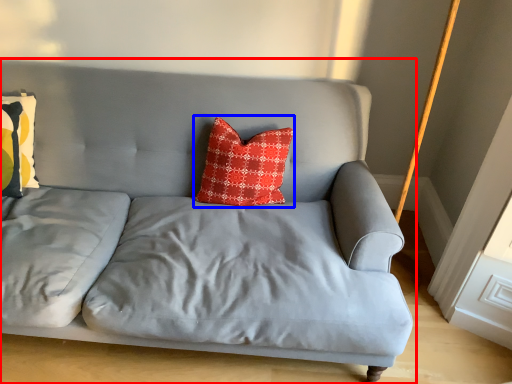
Question: Which point is further to the camera, studio couch (highlighted by a red box) or pillow (highlighted by a blue box)?

Choices:
 (A) studio couch
 (B) pillow

Answer: (B)